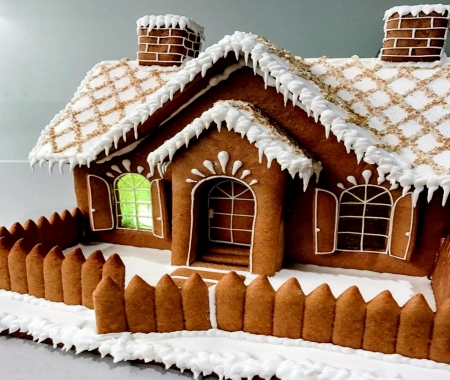
Where is `shutter handles`? The height and width of the screenshot is (380, 450). shutter handles is located at coordinates (92, 208), (156, 218), (318, 226), (408, 232).